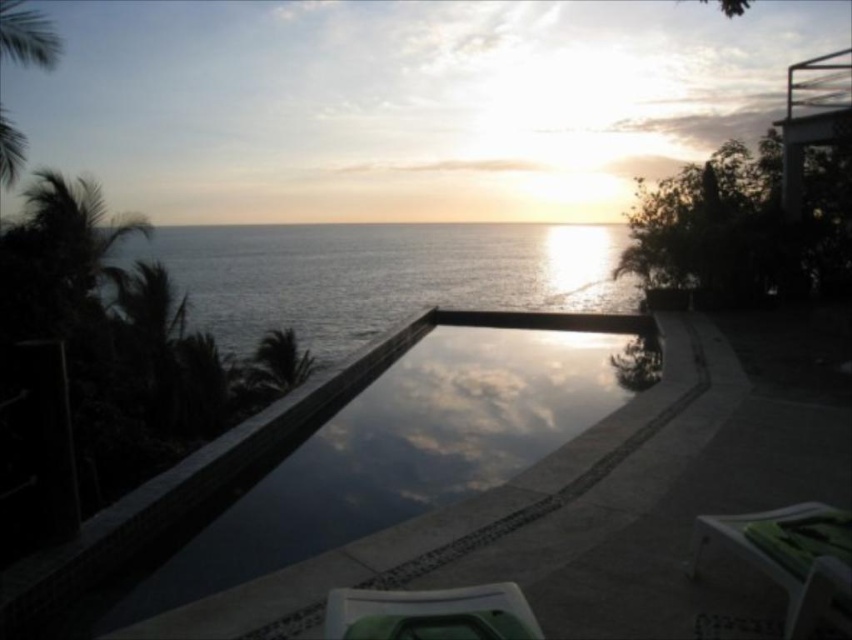
Question: Estimate the real-world distances between objects in this image. Which object is farther from the green leafy palm tree at left?

Choices:
 (A) green plastic chair at lower center
 (B) green plastic chair at lower right

Answer: (A)

Question: Can you confirm if smooth concrete pool at center is smaller than green plastic chair at lower center?

Choices:
 (A) no
 (B) yes

Answer: (A)

Question: Which object appears farthest from the camera in this image?

Choices:
 (A) green plastic chair at lower center
 (B) green leafy palm tree at left
 (C) smooth concrete pool at center
 (D) green plastic chair at lower right

Answer: (B)

Question: Does smooth concrete pool at center appear on the right side of green leafy palm tree at left?

Choices:
 (A) no
 (B) yes

Answer: (B)

Question: Which object is farther from the camera taking this photo?

Choices:
 (A) green plastic chair at lower right
 (B) green leafy palm tree at left
 (C) green plastic chair at lower center

Answer: (B)

Question: Is smooth concrete pool at center smaller than green plastic chair at lower center?

Choices:
 (A) yes
 (B) no

Answer: (B)